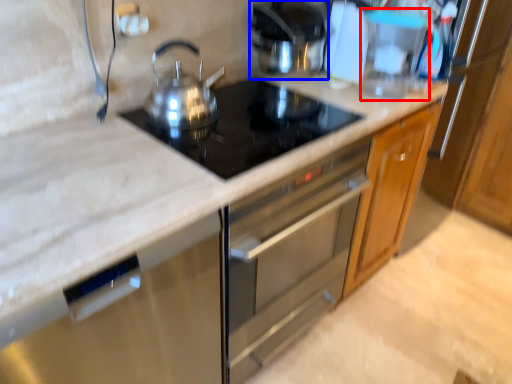
Question: Which object appears closest to the camera in this image, appliance (highlighted by a red box) or kitchen appliance (highlighted by a blue box)?

Choices:
 (A) appliance
 (B) kitchen appliance

Answer: (A)